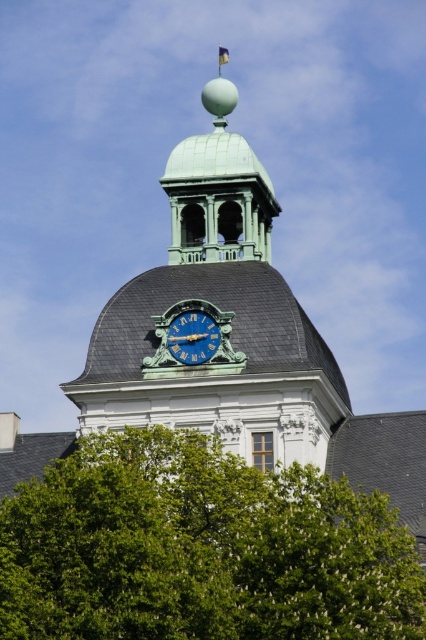
You are an architect designing a miniature model of this building. The scale requires the blue metallic clock at center to be exactly 5 centimeters in diameter. What should be the minimum diameter of the green polished dome at center to maintain the correct scale?

Since the green polished dome at center is bigger than the blue metallic clock at center, and the clock must be 5 centimeters, the dome should be larger than 5 centimeters. The minimum diameter would be just over 5 cm, but to ensure accuracy, it should be scaled proportionally based on the original sizes. However, without exact measurements, the dome must be at least slightly larger than 5 centimeters.